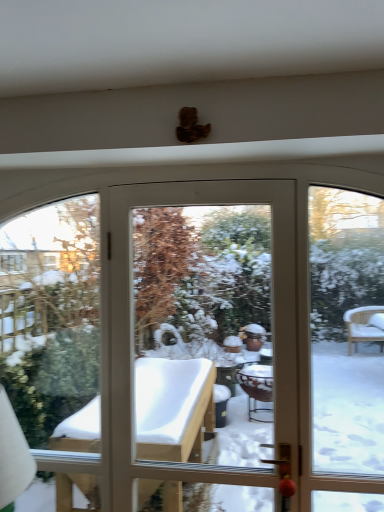
At what (x,y) coordinates should I click in order to perform the action: click on white glossy screen door at center. Please return your answer as a coordinate pair (x, y). Looking at the image, I should click on (193, 307).

This screenshot has height=512, width=384. What do you see at coordinates (193, 307) in the screenshot?
I see `white glossy screen door at center` at bounding box center [193, 307].

Find the location of `white glossy screen door at center`. white glossy screen door at center is located at coordinates (193, 307).